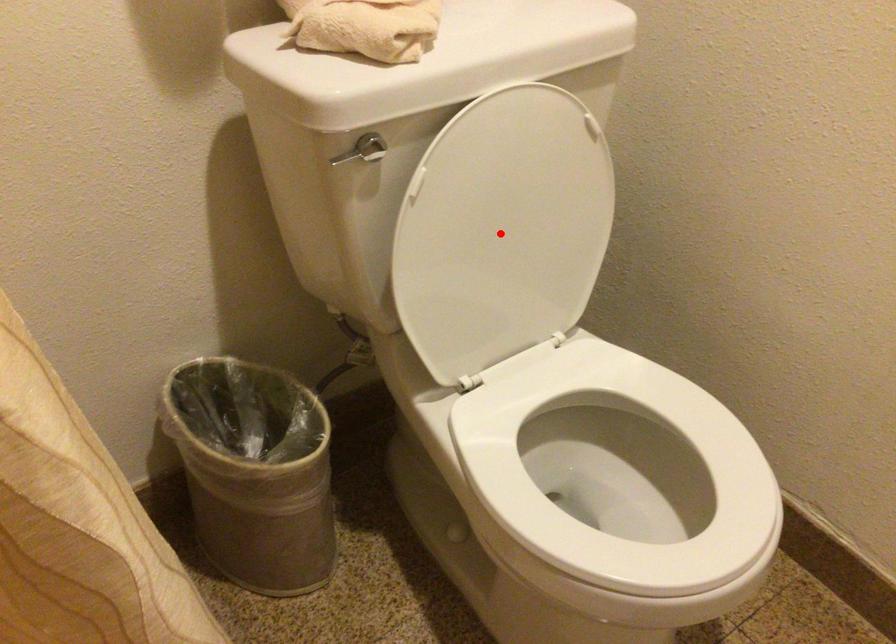
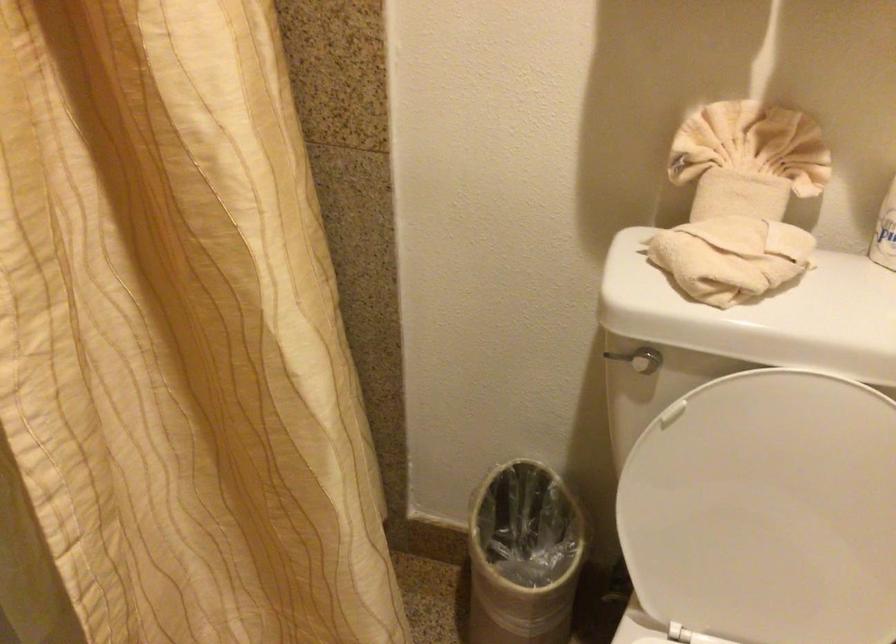
Question: A red point is marked in image1. In image2, is the corresponding 3D point closer to the camera or farther? Reply with the corresponding letter.

Choices:
 (A) The corresponding 3D point is closer.
 (B) The corresponding 3D point is farther.

Answer: (A)